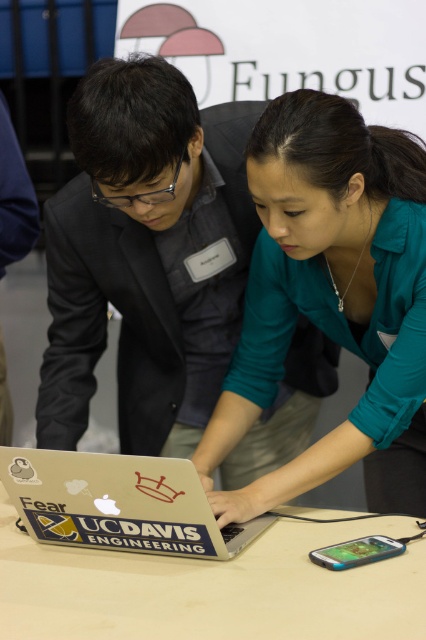
Question: Is matte black laptop at center closer to the viewer compared to teal fabric shirt at center?

Choices:
 (A) no
 (B) yes

Answer: (A)

Question: Which point is closer to the camera?

Choices:
 (A) white matte table at center
 (B) teal fabric shirt at center
 (C) matte black laptop at center

Answer: (A)

Question: Is silver metallic laptop at center wider than teal plastic smartphone at lower center?

Choices:
 (A) yes
 (B) no

Answer: (A)

Question: Which point appears closest to the camera in this image?

Choices:
 (A) (26, 577)
 (B) (74, 147)
 (C) (77, 525)

Answer: (A)

Question: Which point appears farthest from the camera in this image?

Choices:
 (A) (127, 468)
 (B) (247, 336)
 (C) (229, 588)

Answer: (B)

Question: Where is teal fabric shirt at center located in relation to white matte table at center in the image?

Choices:
 (A) above
 (B) below

Answer: (A)